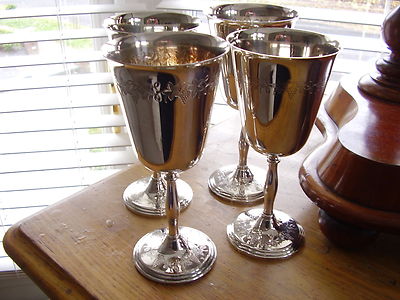
Find the location of a particular element. The width and height of the screenshot is (400, 300). wood base of a lamp is located at coordinates (367, 157).